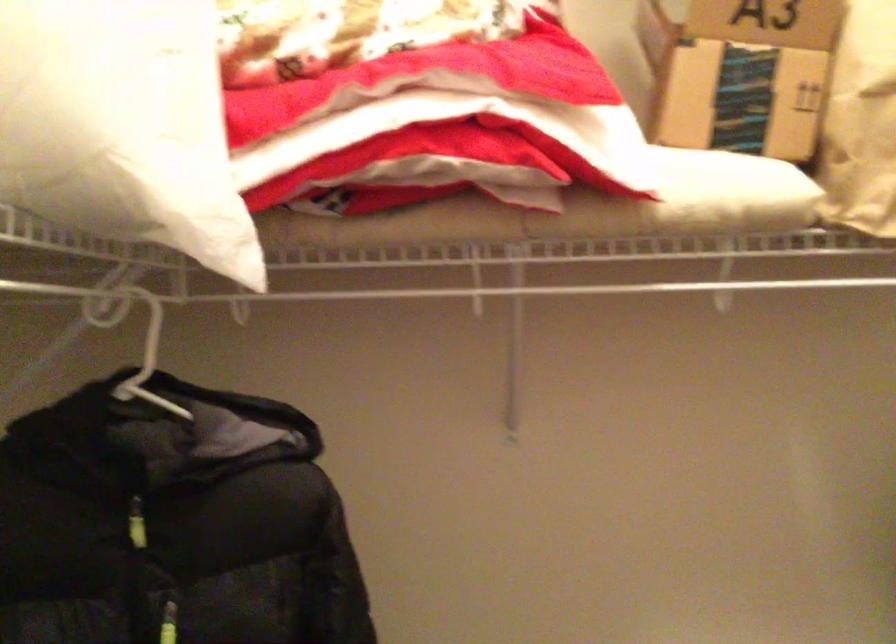
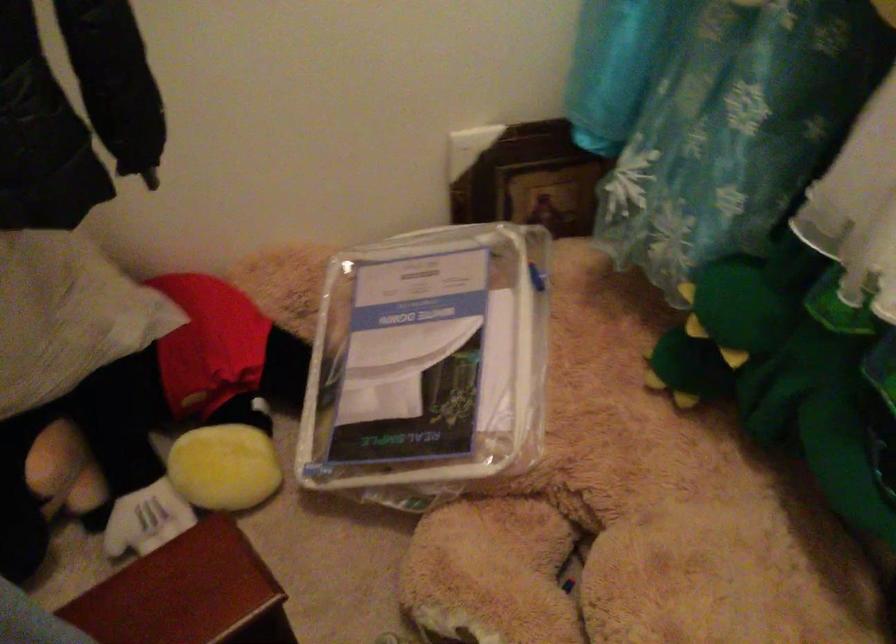
The images are taken continuously from a first-person perspective. In which direction is your viewpoint rotating?

The camera rotated toward right-down.